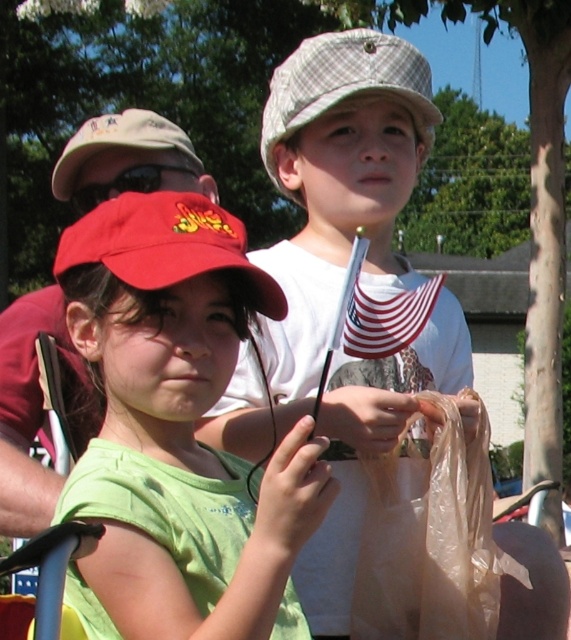
You are standing in the scene and see the translucent plastic bag at lower right. Where is it located relative to the point marked by coordinates (432,541)?

The translucent plastic bag at lower right is located at the coordinates point (432,541).

You are standing in front of the image and want to touch both the point at coordinates point (130, 554) and point (397, 92). Which point should you reach for first?

You should reach for point (130, 554) first because it is closer to you than point (397, 92).

You are a photographer setting up for a group photo. You notice the translucent plastic bag at lower right and the matte red baseball cap at center in your frame. Which object is taller in the image?

The translucent plastic bag at lower right is much taller than the matte red baseball cap at center.